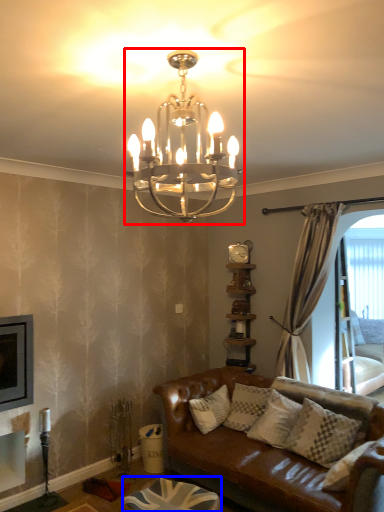
Question: Which point is closer to the camera, lamp (highlighted by a red box) or footrest (highlighted by a blue box)?

Choices:
 (A) lamp
 (B) footrest

Answer: (A)